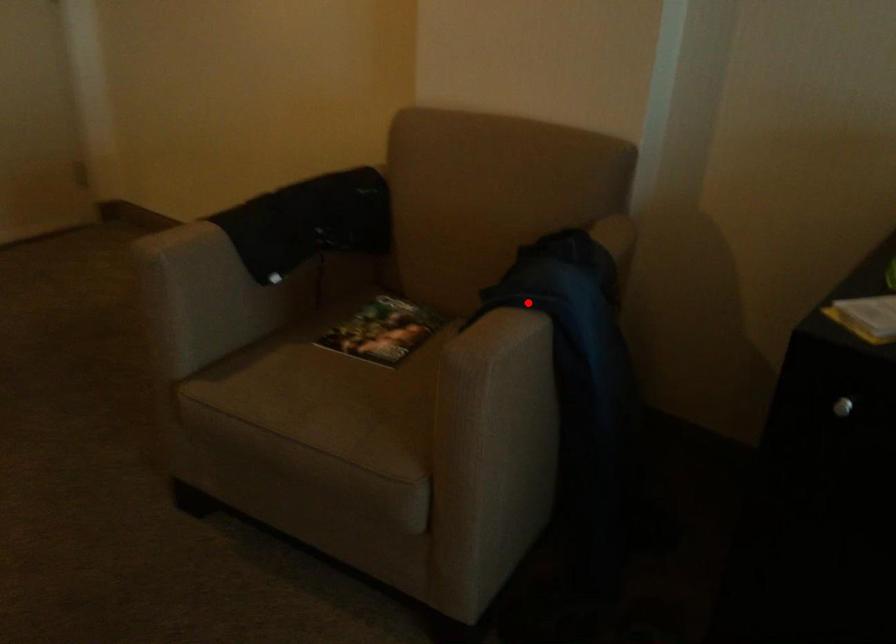
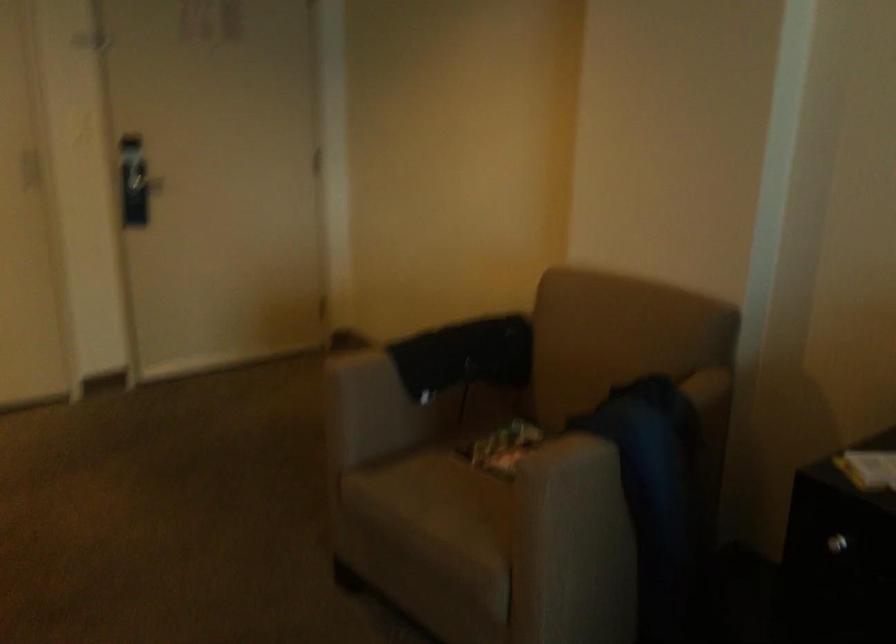
Question: I am providing you with two images of the same scene from different viewpoints. Image1 has a red point marked. In image2, the corresponding 3D location appears at what relative position? Reply with the corresponding letter.

Choices:
 (A) Closer
 (B) Farther

Answer: (B)